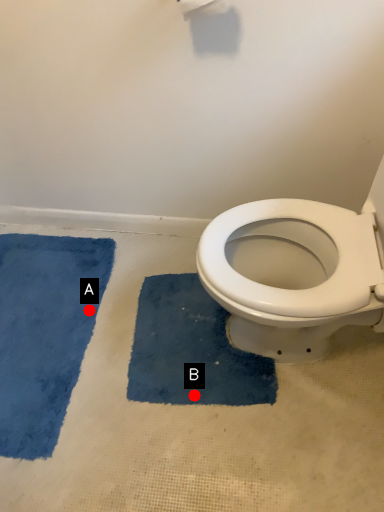
Question: Two points are circled on the image, labeled by A and B beside each circle. Which point is closer to the camera taking this photo?

Choices:
 (A) A is closer
 (B) B is closer

Answer: (B)